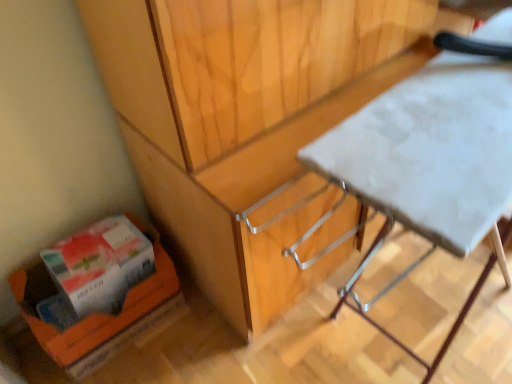
Question: From a real-world perspective, is orange cardboard box at lower left above or below orange cardboard box at lower left?

Choices:
 (A) above
 (B) below

Answer: (A)

Question: Considering the positions of point (93, 241) and point (31, 281), is point (93, 241) closer or farther from the camera than point (31, 281)?

Choices:
 (A) closer
 (B) farther

Answer: (A)

Question: Which is farther from the orange cardboard box at lower left?

Choices:
 (A) orange cardboard box at lower left
 (B) white fabric table at center

Answer: (B)

Question: Which object is the closest to the orange cardboard box at lower left?

Choices:
 (A) orange cardboard box at lower left
 (B) white fabric table at center

Answer: (A)